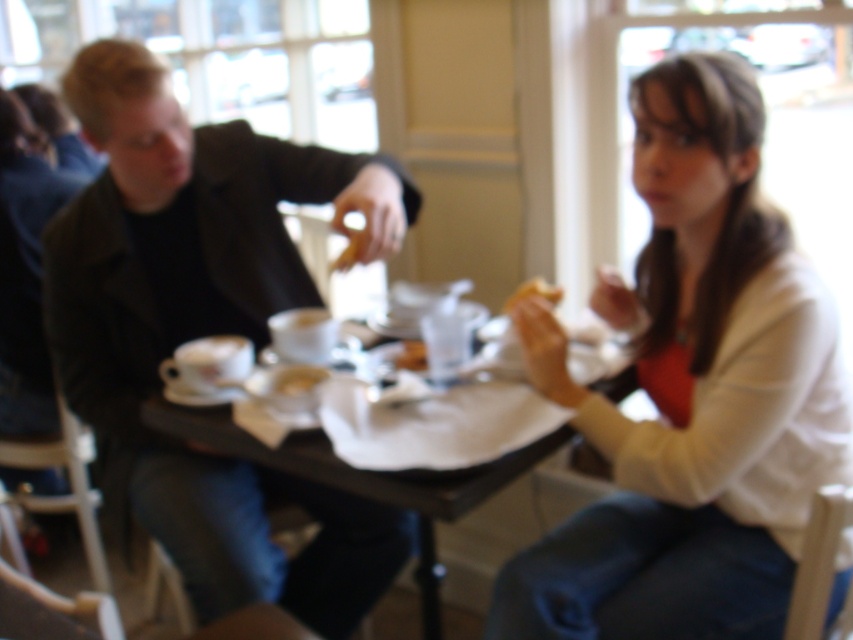
Based on the photo, you are a waiter in a restaurant. You need to place a new drink order for the customer wearing the white matte sweater at upper right. Where should you place the drink relative to the black plastic table at center?

The white matte sweater at upper right is located above the black plastic table at center, so you should place the drink on the table near the customer wearing the white matte sweater at upper right.

You are a photographer trying to capture a closeup of the golden brown bread at center without including the white matte sweater at upper right in the frame. Given their sizes, is this feasible?

The white matte sweater at upper right is wider than the golden brown bread at center, so it might be challenging to frame the bread without including the sweater if they are positioned closely together.